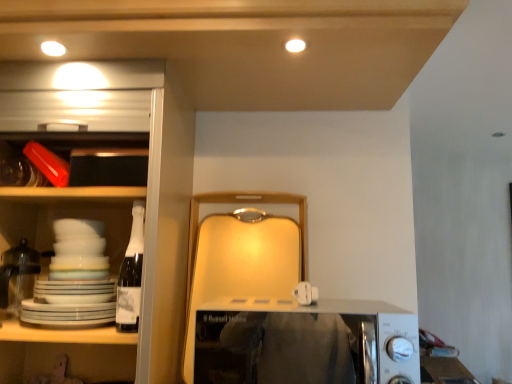
From the picture: Measure the distance between point (42, 237) and camera.

Point (42, 237) and camera are 1.27 meters apart.

Image resolution: width=512 pixels, height=384 pixels. Describe the element at coordinates (108, 205) in the screenshot. I see `white glossy cabinet at left` at that location.

In order to face white glossy cabinet at left, should I rotate leftwards or rightwards?

You should look left and rotate roughly 21.644 degrees.

Find the location of `white glossy cabinet at left`. white glossy cabinet at left is located at coordinates (108, 205).

This screenshot has height=384, width=512. Identify the location of white plastic microwave at center. (304, 343).

Measure the distance between point (x=360, y=306) and camera.

Point (x=360, y=306) and camera are 1.28 meters apart.

Image resolution: width=512 pixels, height=384 pixels. What do you see at coordinates (304, 343) in the screenshot?
I see `white plastic microwave at center` at bounding box center [304, 343].

Locate an element on the screen. The width and height of the screenshot is (512, 384). white glossy cabinet at left is located at coordinates (108, 205).

Is white glossy cabinet at left to the left or to the right of white plastic microwave at center in the image?

white glossy cabinet at left is to the left of white plastic microwave at center.

Is white glossy cabinet at left further to camera compared to white plastic microwave at center?

Yes, white glossy cabinet at left is behind white plastic microwave at center.

Does point (166, 184) appear closer or farther from the camera than point (361, 362)?

Point (166, 184) appears to be farther away from the viewer than point (361, 362).

From the image's perspective, which object appears higher, white glossy cabinet at left or white plastic microwave at center?

white glossy cabinet at left is shown above in the image.

From a real-world perspective, is white glossy cabinet at left on white plastic microwave at center?

Yes, from a real-world perspective, white glossy cabinet at left is above white plastic microwave at center.

Which of these two, white glossy cabinet at left or white plastic microwave at center, is thinner?

With smaller width is white plastic microwave at center.

Based on the photo, can you confirm if white glossy cabinet at left is taller than white plastic microwave at center?

Yes, white glossy cabinet at left is taller than white plastic microwave at center.

Based on the photo, does white glossy cabinet at left have a larger size compared to white plastic microwave at center?

Yes.

Is white glossy cabinet at left located outside white plastic microwave at center?

Indeed, white glossy cabinet at left is completely outside white plastic microwave at center.

Is white glossy cabinet at left not near white plastic microwave at center?

That's not correct — white glossy cabinet at left is a little close to white plastic microwave at center.

Is white glossy cabinet at left facing towards white plastic microwave at center?

No, white glossy cabinet at left is not facing towards white plastic microwave at center.

How much distance is there between white glossy cabinet at left and white plastic microwave at center?

The distance of white glossy cabinet at left from white plastic microwave at center is 43.17 centimeters.

The image size is (512, 384). I want to click on appliance on the right of the white glossy cabinet at left, so click(x=304, y=343).

Does white plastic microwave at center appear on the left side of white glossy cabinet at left?

In fact, white plastic microwave at center is to the right of white glossy cabinet at left.

Which object is closer to the camera taking this photo, white plastic microwave at center or white glossy cabinet at left?

Positioned in front is white plastic microwave at center.

Which is farther from the camera, (248, 322) or (131, 198)?

The point (131, 198) is farther.

From the image's perspective, between white plastic microwave at center and white glossy cabinet at left, which one is located above?

white glossy cabinet at left appears higher in the image.

From a real-world perspective, is white plastic microwave at center physically located above or below white glossy cabinet at left?

white plastic microwave at center is below white glossy cabinet at left.

Can you confirm if white plastic microwave at center is thinner than white glossy cabinet at left?

Yes, white plastic microwave at center is thinner than white glossy cabinet at left.

Between white plastic microwave at center and white glossy cabinet at left, which one has more height?

With more height is white glossy cabinet at left.

Does white plastic microwave at center have a larger size compared to white glossy cabinet at left?

Actually, white plastic microwave at center might be smaller than white glossy cabinet at left.

Is white glossy cabinet at left located within white plastic microwave at center?

No, white glossy cabinet at left is not inside white plastic microwave at center.

Is white plastic microwave at center not near white glossy cabinet at left?

That's not correct — white plastic microwave at center is a little close to white glossy cabinet at left.

Is white plastic microwave at center looking in the opposite direction of white glossy cabinet at left?

white plastic microwave at center does not have its back to white glossy cabinet at left.

What's the angular difference between white plastic microwave at center and white glossy cabinet at left's facing directions?

0.321 degrees.

Based on the photo, measure the distance from white plastic microwave at center to white glossy cabinet at left.

The distance of white plastic microwave at center from white glossy cabinet at left is 17.00 inches.

Identify the location of cabinetry above the white plastic microwave at center (from the image's perspective). (x=108, y=205).

The image size is (512, 384). I want to click on appliance beneath the white glossy cabinet at left (from a real-world perspective), so pyautogui.click(x=304, y=343).

The height and width of the screenshot is (384, 512). I want to click on appliance in front of the white glossy cabinet at left, so click(x=304, y=343).